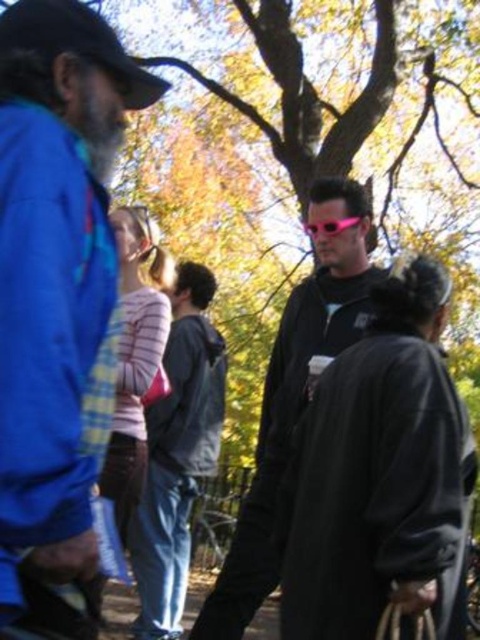
Measure the distance from pink reflective sunglasses at center to dark gray hoodie at center.

The distance of pink reflective sunglasses at center from dark gray hoodie at center is 79.76 centimeters.

Between point (350, 282) and point (172, 561), which one is positioned in front?

Point (350, 282) is in front.

Who is more forward, (342,272) or (189,513)?

Positioned in front is point (342,272).

The image size is (480, 640). I want to click on pink reflective sunglasses at center, so click(294, 397).

Who is lower down, dark gray hoodie at center or blue fabric baseball cap at upper left?

dark gray hoodie at center is lower down.

Based on the photo, can you confirm if dark gray hoodie at center is positioned above blue fabric baseball cap at upper left?

Actually, dark gray hoodie at center is below blue fabric baseball cap at upper left.

Between point (165, 524) and point (17, 8), which one is positioned behind?

The point (165, 524) is more distant.

I want to click on dark gray hoodie at center, so click(178, 454).

Can you confirm if dark gray hoodie at center is taller than pink plastic goggles at center?

Yes.

Which is above, dark gray hoodie at center or pink plastic goggles at center?

pink plastic goggles at center is above.

Is point (164, 426) closer to camera compared to point (346, 218)?

No.

At what (x,y) coordinates should I click in order to perform the action: click on dark gray hoodie at center. Please return your answer as a coordinate pair (x, y). The height and width of the screenshot is (640, 480). Looking at the image, I should click on 178,454.